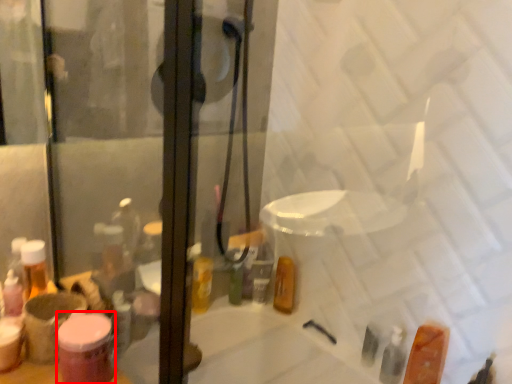
Question: From the image, what is the correct spatial relationship of toiletry (annotated by the red box) in relation to toiletry?

Choices:
 (A) right
 (B) left

Answer: (B)